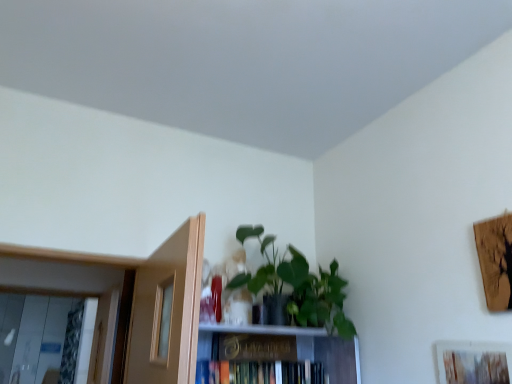
Question: Considering their positions, is wooden textured picture frame at lower right located in front of or behind green matte plant at upper center?

Choices:
 (A) behind
 (B) front

Answer: (B)

Question: Looking at their shapes, would you say wooden textured picture frame at lower right is wider or thinner than green matte plant at upper center?

Choices:
 (A) wide
 (B) thin

Answer: (B)

Question: Which object is the closest to the wooden textured picture frame at lower right?

Choices:
 (A) hardcover book at center
 (B) gold metallic paperback book at center
 (C) green matte plant at upper center

Answer: (C)

Question: Estimate the real-world distances between objects in this image. Which object is farther from the wooden textured picture frame at lower right?

Choices:
 (A) hardcover book at center
 (B) green matte plant at upper center
 (C) gold metallic paperback book at center

Answer: (A)